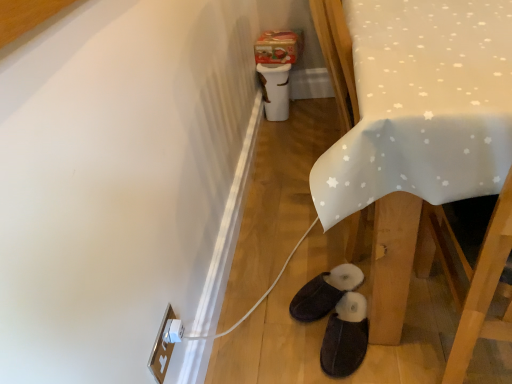
Question: Considering the relative sizes of dark brown suede slippers at lower center, the 1th footwear in the front-to-back sequence, and black suede slippers at lower center, which is counted as the 1th footwear, starting from the back, in the image provided, is dark brown suede slippers at lower center, the 1th footwear in the front-to-back sequence, wider than black suede slippers at lower center, which is counted as the 1th footwear, starting from the back,?

Choices:
 (A) yes
 (B) no

Answer: (A)

Question: Can you confirm if dark brown suede slippers at lower center, the 1th footwear in the front-to-back sequence, is positioned to the right of black suede slippers at lower center, arranged as the second footwear when viewed from the front?

Choices:
 (A) no
 (B) yes

Answer: (B)

Question: Could you tell me if dark brown suede slippers at lower center, the 1th footwear in the front-to-back sequence, is facing black suede slippers at lower center, which is counted as the 1th footwear, starting from the back?

Choices:
 (A) yes
 (B) no

Answer: (B)

Question: From the image's perspective, does dark brown suede slippers at lower center, the 1th footwear in the front-to-back sequence, appear lower than black suede slippers at lower center, which is counted as the 1th footwear, starting from the back?

Choices:
 (A) no
 (B) yes

Answer: (B)

Question: Does dark brown suede slippers at lower center, the 1th footwear in the front-to-back sequence, have a smaller size compared to black suede slippers at lower center, which is counted as the 1th footwear, starting from the back?

Choices:
 (A) no
 (B) yes

Answer: (A)

Question: Does point (399, 256) appear closer or farther from the camera than point (348, 354)?

Choices:
 (A) closer
 (B) farther

Answer: (A)

Question: Considering the positions of white fabric table at lower right and dark brown suede slippers at lower center, which ranks as the second footwear in back-to-front order, in the image, is white fabric table at lower right bigger or smaller than dark brown suede slippers at lower center, which ranks as the second footwear in back-to-front order,?

Choices:
 (A) big
 (B) small

Answer: (A)

Question: In terms of height, does white fabric table at lower right look taller or shorter compared to dark brown suede slippers at lower center, which ranks as the second footwear in back-to-front order?

Choices:
 (A) short
 (B) tall

Answer: (B)

Question: In terms of width, does white fabric table at lower right look wider or thinner when compared to dark brown suede slippers at lower center, which ranks as the second footwear in back-to-front order?

Choices:
 (A) thin
 (B) wide

Answer: (B)

Question: From the image's perspective, is white fabric table at lower right positioned above or below white plastic electric outlet at lower left?

Choices:
 (A) below
 (B) above

Answer: (B)

Question: Would you say white fabric table at lower right is to the left or to the right of white plastic electric outlet at lower left in the picture?

Choices:
 (A) right
 (B) left

Answer: (A)

Question: In terms of size, does white fabric table at lower right appear bigger or smaller than white plastic electric outlet at lower left?

Choices:
 (A) big
 (B) small

Answer: (A)

Question: Would you say white fabric table at lower right is inside or outside white plastic electric outlet at lower left?

Choices:
 (A) outside
 (B) inside

Answer: (A)

Question: In the image, is black suede slippers at lower center, which is counted as the 1th footwear, starting from the back, positioned in front of or behind white plastic electric outlet at lower left?

Choices:
 (A) front
 (B) behind

Answer: (B)

Question: From the image's perspective, is black suede slippers at lower center, which is counted as the 1th footwear, starting from the back, positioned above or below white plastic electric outlet at lower left?

Choices:
 (A) below
 (B) above

Answer: (B)